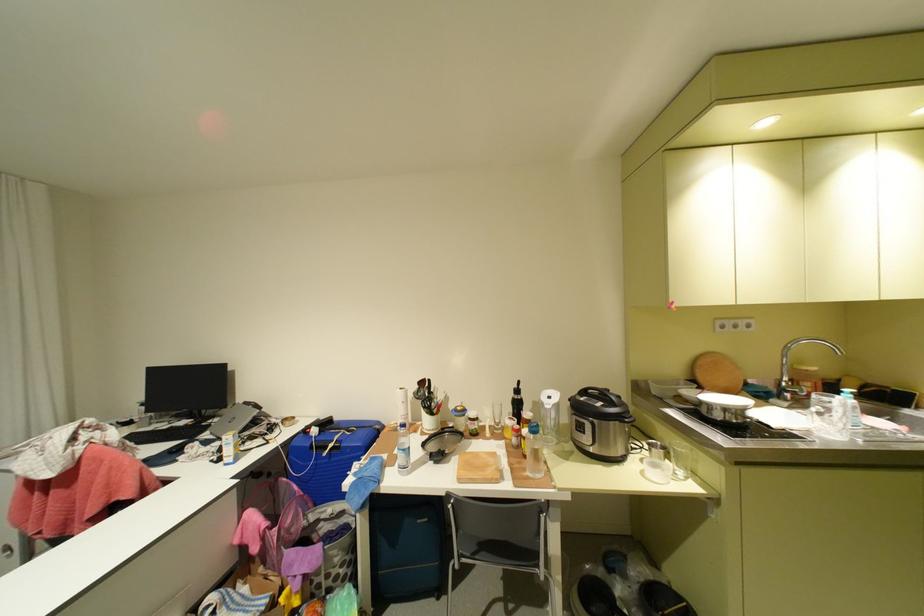
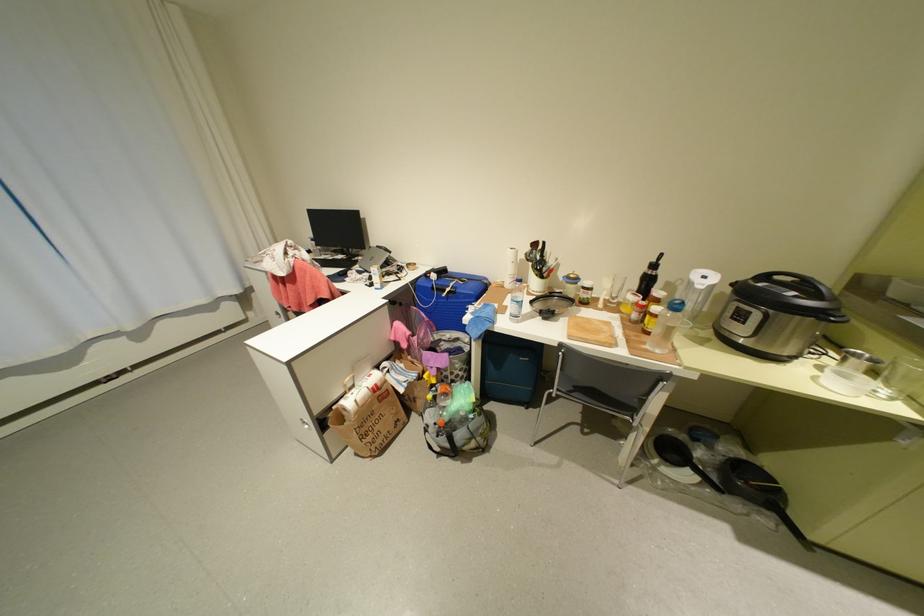
Find the pixel in the second image that matches point (652, 472) in the first image.

(824, 379)